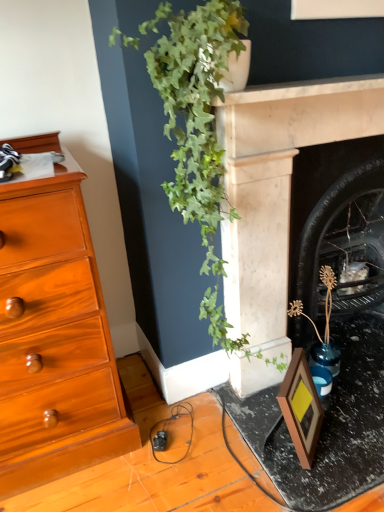
Question: Is matte black frame at lower right completely or partially inside green leafy plant at upper center?

Choices:
 (A) no
 (B) yes

Answer: (A)

Question: Is the depth of green leafy plant at upper center greater than that of matte black frame at lower right?

Choices:
 (A) no
 (B) yes

Answer: (A)

Question: Is there a large distance between green leafy plant at upper center and matte black frame at lower right?

Choices:
 (A) yes
 (B) no

Answer: (B)

Question: From a real-world perspective, is green leafy plant at upper center beneath matte black frame at lower right?

Choices:
 (A) yes
 (B) no

Answer: (B)

Question: From a real-world perspective, is green leafy plant at upper center positioned over matte black frame at lower right based on gravity?

Choices:
 (A) yes
 (B) no

Answer: (A)

Question: Is green leafy plant at upper center to the left of matte black frame at lower right from the viewer's perspective?

Choices:
 (A) no
 (B) yes

Answer: (B)

Question: From a real-world perspective, is black marble fireplace at center-right, which is the second fireplace in front-to-back order, under green leafy plant at upper center?

Choices:
 (A) yes
 (B) no

Answer: (A)

Question: Does black marble fireplace at center-right, which is the second fireplace in front-to-back order, have a larger size compared to green leafy plant at upper center?

Choices:
 (A) yes
 (B) no

Answer: (A)

Question: Is green leafy plant at upper center at the back of black marble fireplace at center-right, marked as the 1th fireplace in a back-to-front arrangement?

Choices:
 (A) no
 (B) yes

Answer: (A)

Question: Is there a large distance between black marble fireplace at center-right, which is the second fireplace in front-to-back order, and green leafy plant at upper center?

Choices:
 (A) yes
 (B) no

Answer: (B)

Question: Is black marble fireplace at center-right, marked as the 1th fireplace in a back-to-front arrangement, located outside green leafy plant at upper center?

Choices:
 (A) yes
 (B) no

Answer: (A)

Question: Can you confirm if black marble fireplace at center-right, marked as the 1th fireplace in a back-to-front arrangement, is wider than green leafy plant at upper center?

Choices:
 (A) no
 (B) yes

Answer: (A)

Question: Is matte black frame at lower right facing away from black marble fireplace at center-right, which is the second fireplace in front-to-back order?

Choices:
 (A) no
 (B) yes

Answer: (A)